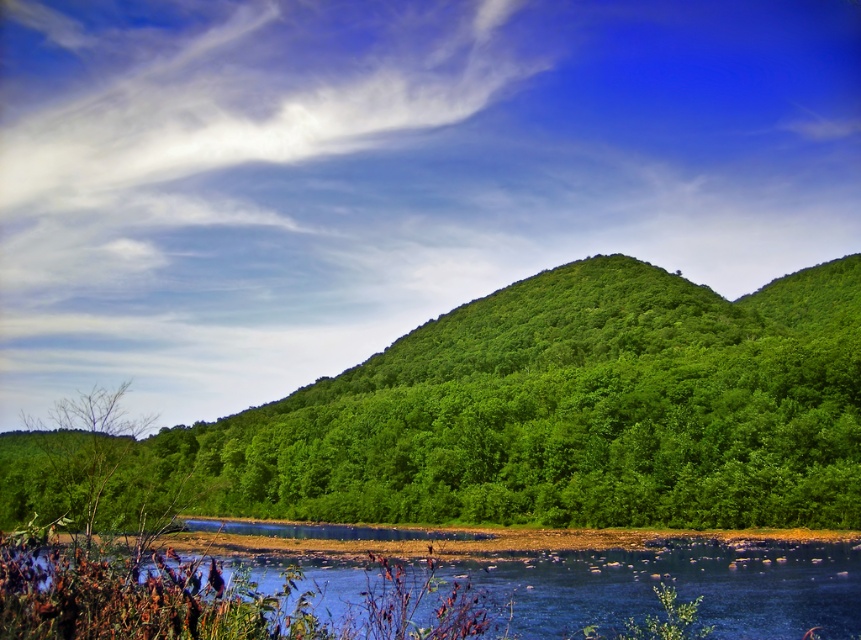
Is the position of blue water at lower center less distant than that of green leafy tree at lower left?

Yes, blue water at lower center is in front of green leafy tree at lower left.

Consider the image. Between blue water at lower center and green leafy tree at lower left, which one is positioned lower?

Positioned lower is green leafy tree at lower left.

Between point (484, 634) and point (98, 448), which one is positioned in front?

Point (484, 634)

Find the location of a particular element. This screenshot has width=861, height=640. blue water at lower center is located at coordinates (430, 596).

Which is below, green leafy tree at center or blue water at lower center?

blue water at lower center is lower down.

Can you confirm if green leafy tree at center is taller than blue water at lower center?

Yes, green leafy tree at center is taller than blue water at lower center.

Does point (787, 467) come farther from viewer compared to point (692, 580)?

Yes, point (787, 467) is behind point (692, 580).

Image resolution: width=861 pixels, height=640 pixels. Find the location of `green leafy tree at center`. green leafy tree at center is located at coordinates (558, 413).

Which is behind, point (763, 381) or point (54, 464)?

The point (54, 464) is more distant.

Who is more forward, (456, 472) or (60, 452)?

Positioned in front is point (456, 472).

Locate an element on the screen. The image size is (861, 640). green leafy tree at center is located at coordinates (558, 413).